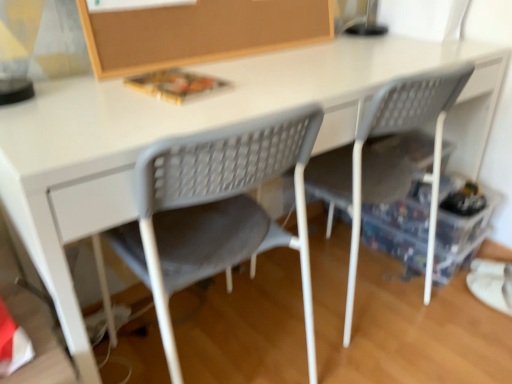
Question: Is gray plastic chair at center, the second chair positioned from the left, positioned behind gray mesh chair at center, marked as the 1th chair in a left-to-right arrangement?

Choices:
 (A) no
 (B) yes

Answer: (B)

Question: Does gray plastic chair at center, which appears as the 1th chair when viewed from the right, have a smaller size compared to gray mesh chair at center, the second chair when ordered from right to left?

Choices:
 (A) no
 (B) yes

Answer: (A)

Question: Is gray plastic chair at center, the second chair positioned from the left, to the left of gray mesh chair at center, marked as the 1th chair in a left-to-right arrangement, from the viewer's perspective?

Choices:
 (A) yes
 (B) no

Answer: (B)

Question: From a real-world perspective, is gray plastic chair at center, the second chair positioned from the left, located beneath gray mesh chair at center, the second chair when ordered from right to left?

Choices:
 (A) yes
 (B) no

Answer: (B)

Question: Does gray plastic chair at center, which appears as the 1th chair when viewed from the right, have a greater width compared to gray mesh chair at center, the second chair when ordered from right to left?

Choices:
 (A) no
 (B) yes

Answer: (B)

Question: Is gray plastic chair at center, the second chair positioned from the left, oriented away from gray mesh chair at center, the second chair when ordered from right to left?

Choices:
 (A) yes
 (B) no

Answer: (B)

Question: Is transparent plastic storage box at lower right thinner than gray plastic chair at center, the second chair positioned from the left?

Choices:
 (A) no
 (B) yes

Answer: (B)

Question: Considering the relative positions of transparent plastic storage box at lower right and gray plastic chair at center, which appears as the 1th chair when viewed from the right, in the image provided, is transparent plastic storage box at lower right to the left of gray plastic chair at center, which appears as the 1th chair when viewed from the right, from the viewer's perspective?

Choices:
 (A) yes
 (B) no

Answer: (B)

Question: From the image's perspective, does transparent plastic storage box at lower right appear lower than gray plastic chair at center, which appears as the 1th chair when viewed from the right?

Choices:
 (A) no
 (B) yes

Answer: (B)

Question: Can you confirm if transparent plastic storage box at lower right is smaller than gray plastic chair at center, which appears as the 1th chair when viewed from the right?

Choices:
 (A) no
 (B) yes

Answer: (B)

Question: Does transparent plastic storage box at lower right contain gray plastic chair at center, which appears as the 1th chair when viewed from the right?

Choices:
 (A) no
 (B) yes

Answer: (A)

Question: From a real-world perspective, is transparent plastic storage box at lower right below gray plastic chair at center, which appears as the 1th chair when viewed from the right?

Choices:
 (A) yes
 (B) no

Answer: (A)

Question: Is burlap board at upper center directly adjacent to gray plastic chair at center, which appears as the 1th chair when viewed from the right?

Choices:
 (A) no
 (B) yes

Answer: (A)